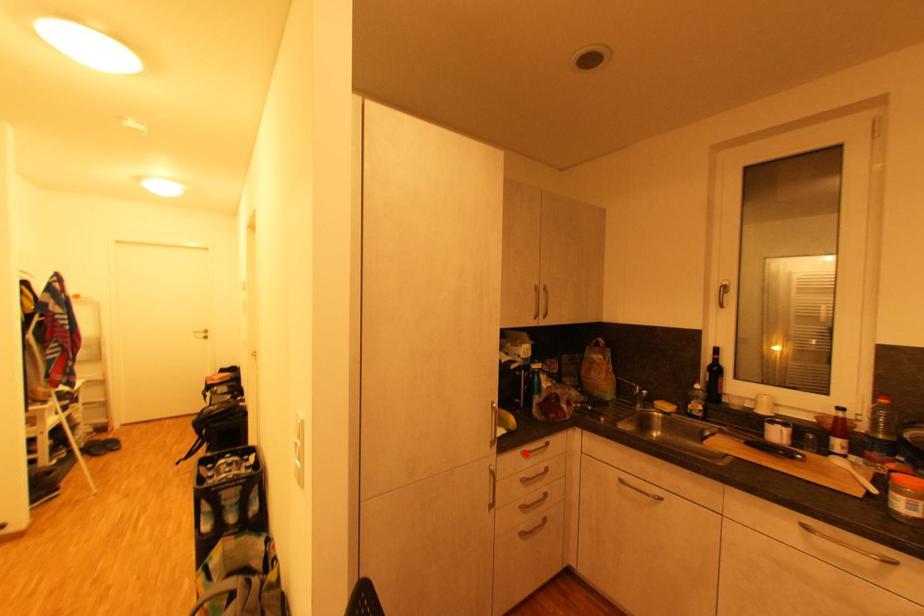
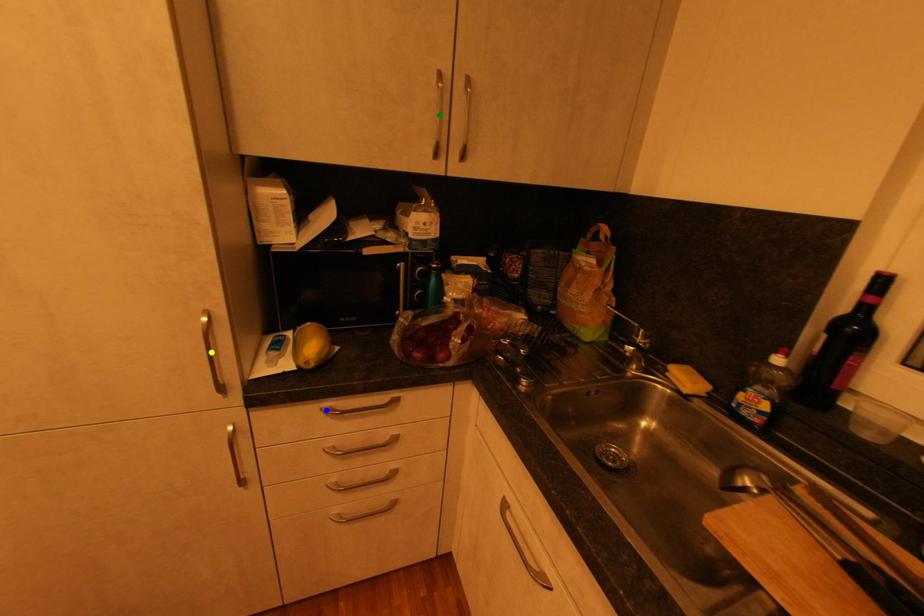
Question: I am providing you with two images of the same scene from different viewpoints. A red point is marked on the first image. You are given multiple points on the second image. Which point in image 2 is actually the same real-world point as the red point in image 1?

Choices:
 (A) blue point
 (B) green point
 (C) yellow point

Answer: (A)